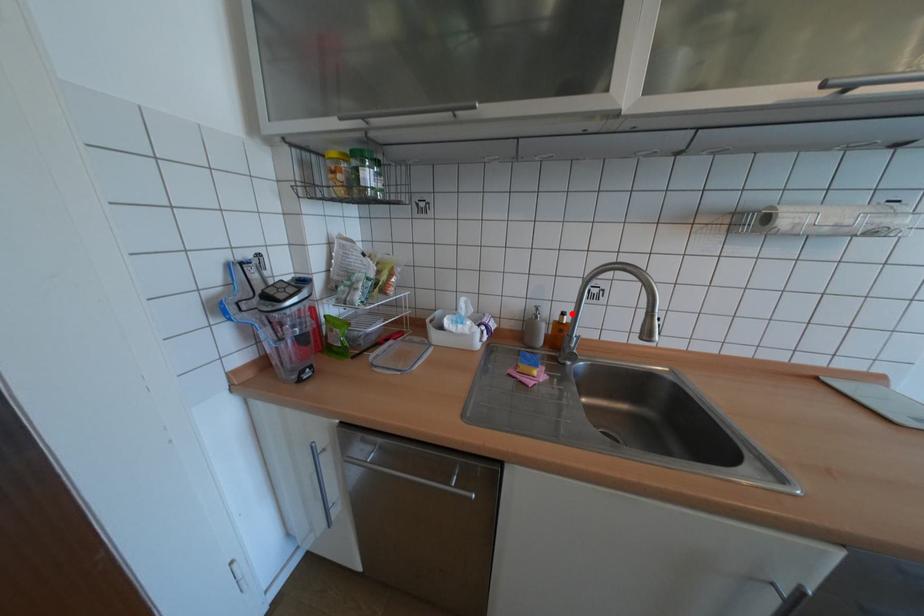
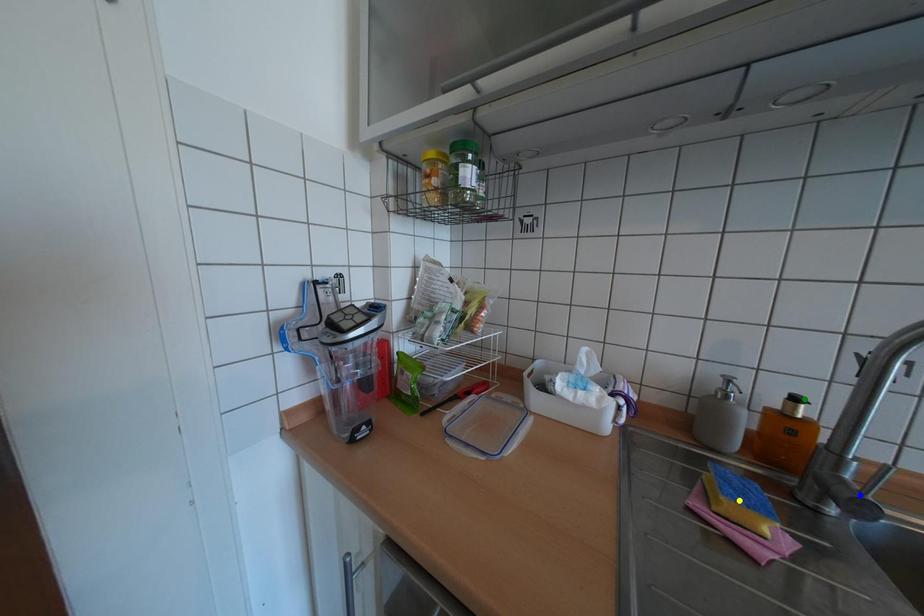
Question: I am providing you with two images of the same scene from different viewpoints. A red point is marked on the first image. You are given multiple points on the second image. Which point in image 2 is actually the same real-world point as the red point in image 1?

Choices:
 (A) yellow point
 (B) blue point
 (C) green point

Answer: (C)